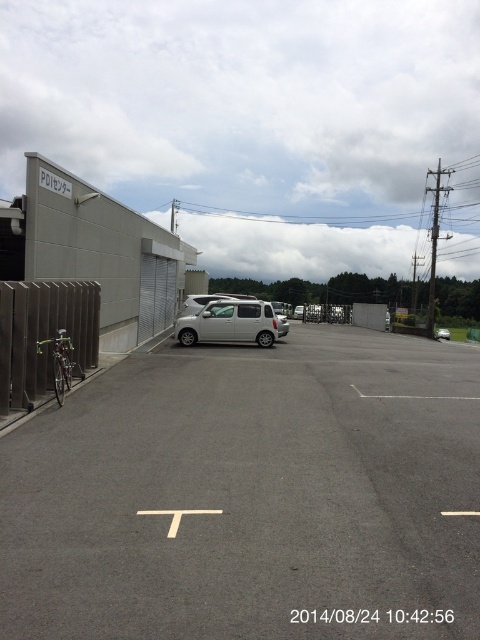
Is point (287, 323) closer to viewer compared to point (446, 337)?

Yes, point (287, 323) is closer to viewer.

Is satin silver van at center shorter than silver metallic car at center?

No, satin silver van at center is not shorter than silver metallic car at center.

Is point (282, 333) positioned in front of point (446, 333)?

Yes, point (282, 333) is in front of point (446, 333).

Image resolution: width=480 pixels, height=640 pixels. Identify the location of satin silver van at center. (282, 323).

Can you confirm if green matte bicycle at left is positioned above satin silver van at center?

No.

Is green matte bicycle at left taller than satin silver van at center?

No, green matte bicycle at left is not taller than satin silver van at center.

Who is more forward, (58, 332) or (285, 321)?

Point (58, 332) is in front.

Identify the location of green matte bicycle at left. The image size is (480, 640). (60, 362).

Is point (72, 348) farther from viewer compared to point (444, 332)?

No, (72, 348) is in front of (444, 332).

This screenshot has height=640, width=480. What do you see at coordinates (60, 362) in the screenshot?
I see `green matte bicycle at left` at bounding box center [60, 362].

The width and height of the screenshot is (480, 640). Identify the location of green matte bicycle at left. (60, 362).